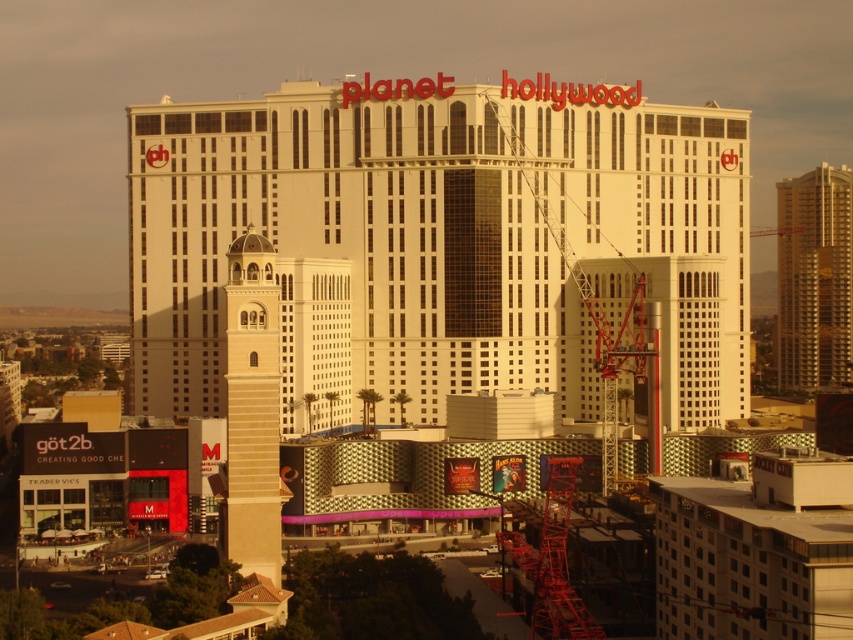
Question: Is white textured building at center to the right of gold metallic building at right from the viewer's perspective?

Choices:
 (A) yes
 (B) no

Answer: (B)

Question: Which point is closer to the camera?

Choices:
 (A) (786, 314)
 (B) (264, 198)

Answer: (B)

Question: Can you confirm if white textured building at center is smaller than gold metallic building at right?

Choices:
 (A) no
 (B) yes

Answer: (A)

Question: Which object appears closest to the camera in this image?

Choices:
 (A) white textured building at center
 (B) gold metallic building at right

Answer: (A)

Question: Can you confirm if white textured building at center is positioned to the left of gold metallic building at right?

Choices:
 (A) no
 (B) yes

Answer: (B)